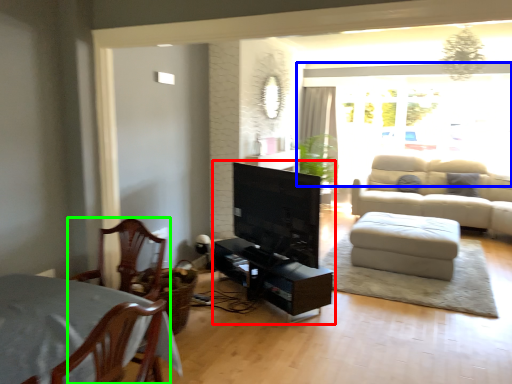
Question: Considering the real-world distances, which object is closest to entertainment center (highlighted by a red box)? window (highlighted by a blue box) or chair (highlighted by a green box).

Choices:
 (A) window
 (B) chair

Answer: (B)